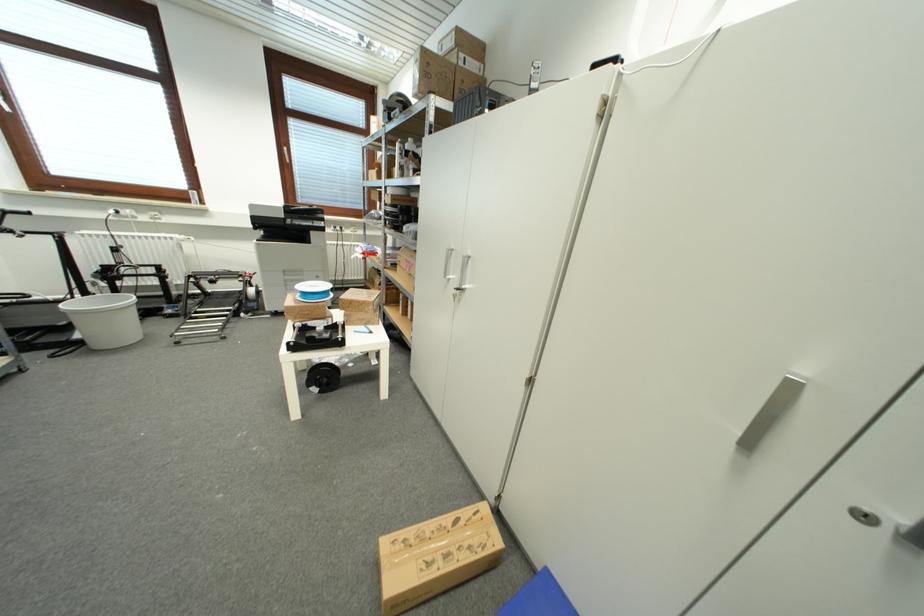
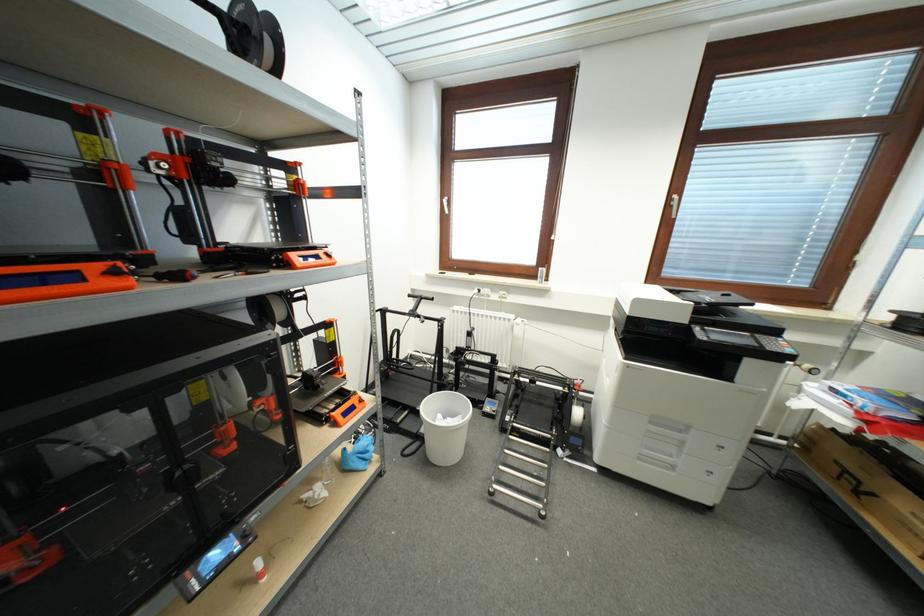
Locate, in the second image, the point that corresponds to point 292,280 in the first image.

(658, 431)